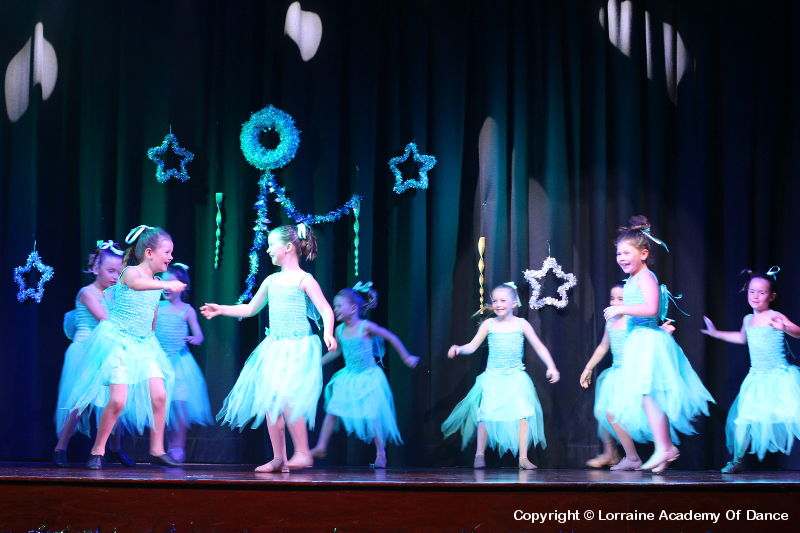
Identify the location of light brown swirly stick decorations. (485, 274), (366, 247), (210, 231).